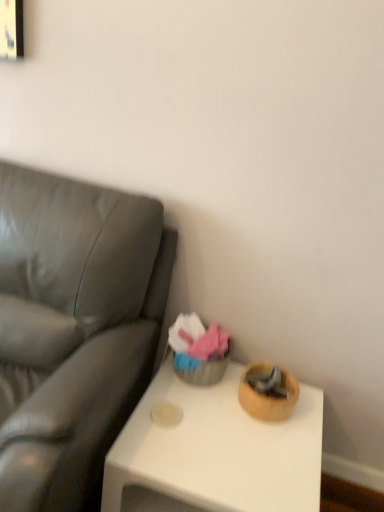
Question: From the image's perspective, is wooden bowl at lower right on leather-like gray couch at left?

Choices:
 (A) yes
 (B) no

Answer: (B)

Question: Does wooden bowl at lower right have a greater height compared to leather-like gray couch at left?

Choices:
 (A) no
 (B) yes

Answer: (A)

Question: Can you confirm if wooden bowl at lower right is bigger than leather-like gray couch at left?

Choices:
 (A) yes
 (B) no

Answer: (B)

Question: Is the position of wooden bowl at lower right less distant than that of leather-like gray couch at left?

Choices:
 (A) yes
 (B) no

Answer: (B)

Question: Is wooden bowl at lower right outside of leather-like gray couch at left?

Choices:
 (A) yes
 (B) no

Answer: (A)

Question: From the image's perspective, would you say wooden bowl at lower right is shown under leather-like gray couch at left?

Choices:
 (A) no
 (B) yes

Answer: (B)

Question: From the image's perspective, is leather-like gray couch at left above wooden bowl at lower right?

Choices:
 (A) no
 (B) yes

Answer: (B)

Question: Can you confirm if leather-like gray couch at left is taller than wooden bowl at lower right?

Choices:
 (A) yes
 (B) no

Answer: (A)

Question: From a real-world perspective, is leather-like gray couch at left beneath wooden bowl at lower right?

Choices:
 (A) no
 (B) yes

Answer: (A)

Question: Does leather-like gray couch at left appear on the right side of wooden bowl at lower right?

Choices:
 (A) no
 (B) yes

Answer: (A)

Question: Can you see leather-like gray couch at left touching wooden bowl at lower right?

Choices:
 (A) no
 (B) yes

Answer: (A)

Question: Is leather-like gray couch at left closer to camera compared to wooden bowl at lower right?

Choices:
 (A) yes
 (B) no

Answer: (A)

Question: Looking at the image, does wooden bowl at lower right seem bigger or smaller compared to leather-like gray couch at left?

Choices:
 (A) big
 (B) small

Answer: (B)